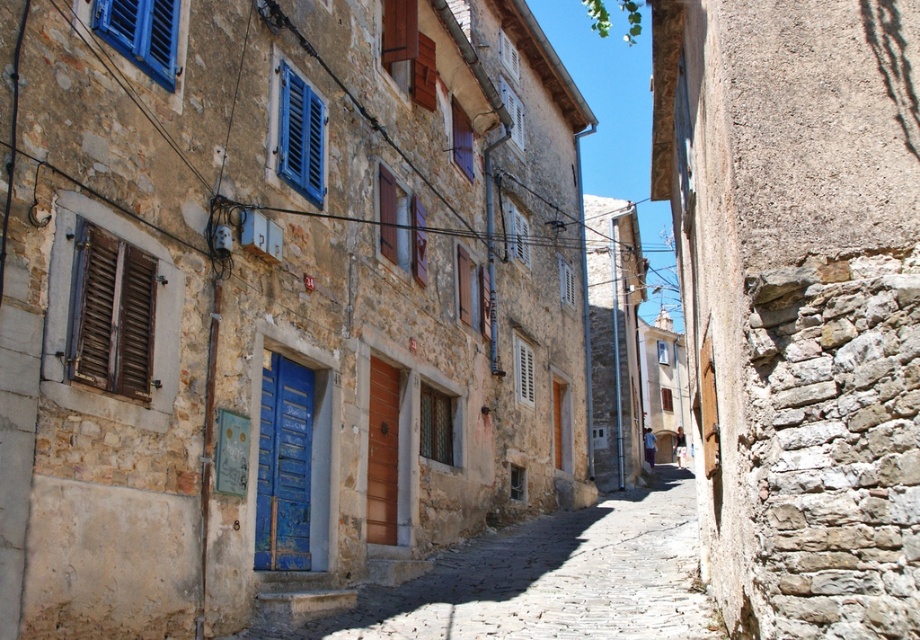
Question: In this image, where is blue wooden door at center located relative to brown wooden door at center?

Choices:
 (A) right
 (B) left

Answer: (B)

Question: Among these objects, which one is nearest to the camera?

Choices:
 (A) blue wooden door at center
 (B) blue painted wood at upper left
 (C) blue wooden shutters at center

Answer: (B)

Question: Which point appears closest to the camera in this image?

Choices:
 (A) (685, 580)
 (B) (398, 412)

Answer: (A)

Question: Is smooth stone alley at center below blue painted wood at upper left?

Choices:
 (A) yes
 (B) no

Answer: (A)

Question: Is the position of blue painted wood at upper left more distant than that of blue wooden shutters at center?

Choices:
 (A) yes
 (B) no

Answer: (B)

Question: Which object appears closest to the camera in this image?

Choices:
 (A) blue wooden shutters at center
 (B) blue painted wood at upper left
 (C) white wooden shutter at center
 (D) brown wooden shutters at left

Answer: (D)